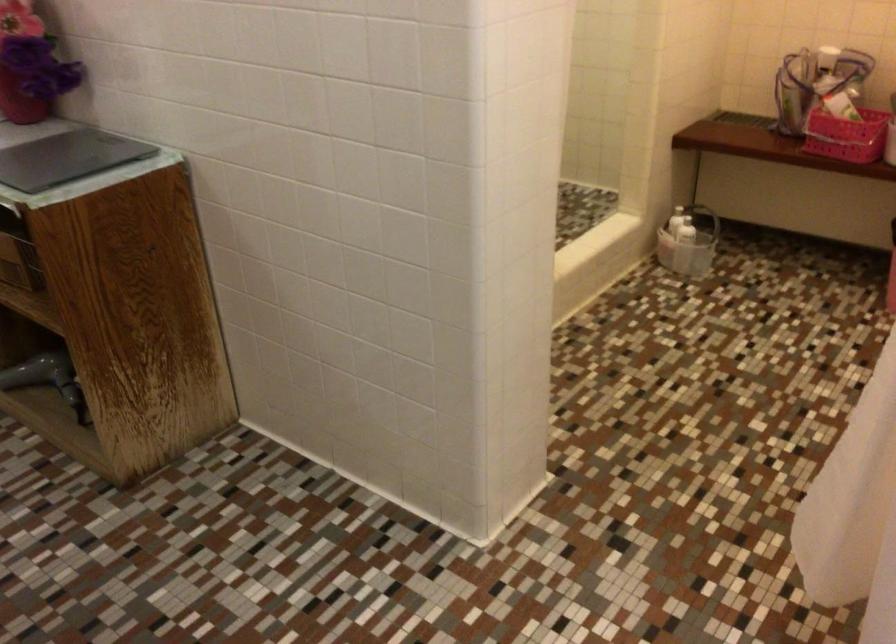
Find where to lift the white shampoo bottle. Please return your answer as a coordinate pair (x, y).

(678, 220)